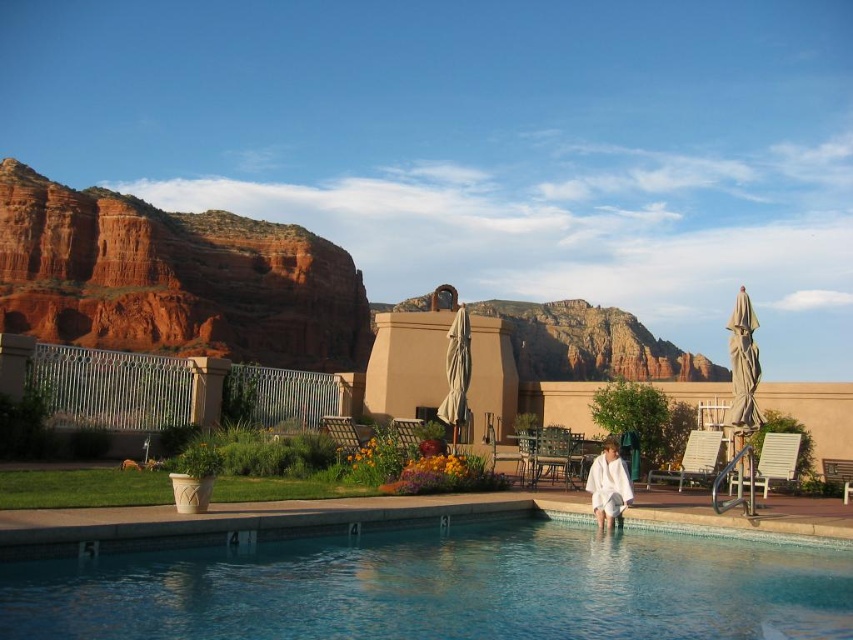
You are standing in the pool area and want to take a photo of both the point at coordinates point (78, 636) and point (606, 504). Which point should you focus on first to ensure both are in the frame?

You should focus on point (78, 636) first because it is closer to the camera than point (606, 504), ensuring both points are within the frame.